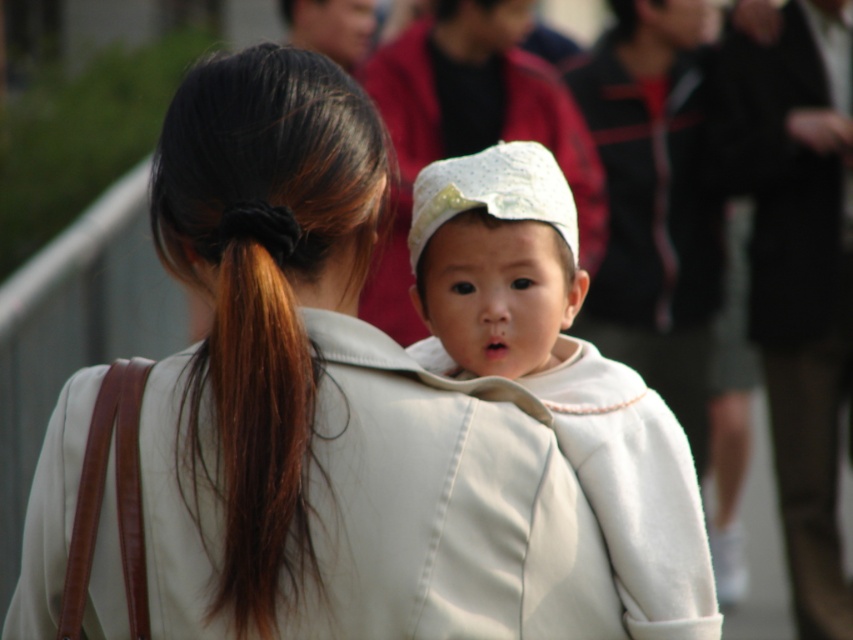
Question: Among these points, which one is nearest to the camera?

Choices:
 (A) (337, 269)
 (B) (323, 227)

Answer: (B)

Question: Is the position of white leather jacket at center less distant than that of white soft hat at center?

Choices:
 (A) yes
 (B) no

Answer: (A)

Question: Does white soft hat at center have a lesser width compared to brown silky hair at upper left?

Choices:
 (A) no
 (B) yes

Answer: (A)

Question: Which point is farther to the camera?

Choices:
 (A) (286, 269)
 (B) (236, 529)
 (C) (496, 200)

Answer: (C)

Question: Estimate the real-world distances between objects in this image. Which object is closer to the brown silky hair at upper left?

Choices:
 (A) white leather jacket at center
 (B) white soft hat at center

Answer: (A)

Question: Is white soft hat at center below brown silky hair at upper left?

Choices:
 (A) no
 (B) yes

Answer: (B)